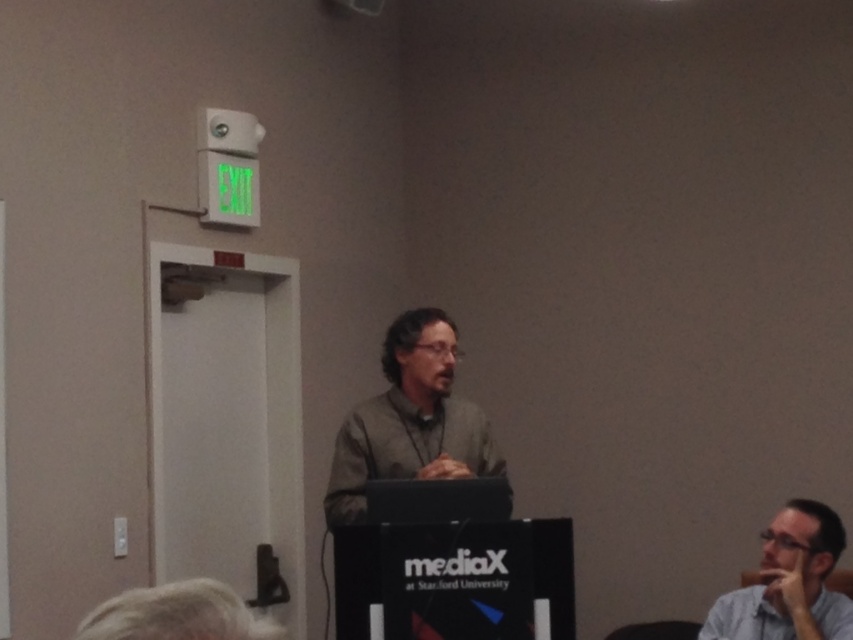
You are attending a presentation and want to know which person is closer to the front. The speaker is wearing a matte gray shirt at center, and there is another person in a light blue shirt at lower right. Based on their positions, which one is closer to the front of the stage?

The matte gray shirt at center is closer to the front of the stage since it is positioned at the center, which is typically where the podium is located, while the light blue shirt at lower right is seated further back.

From the picture: You are attending a presentation and notice two shirts in the scene. The matte gray shirt at center and the light blue shirt at lower right. Which shirt is taller?

The matte gray shirt at center is much taller than the light blue shirt at lower right.

In the scene described, there are two shirts visible. The matte gray shirt at center and the light blue shirt at lower right. Which shirt is positioned to the left when viewed from the front of the image?

The matte gray shirt at center is positioned to the left of the light blue shirt at lower right.